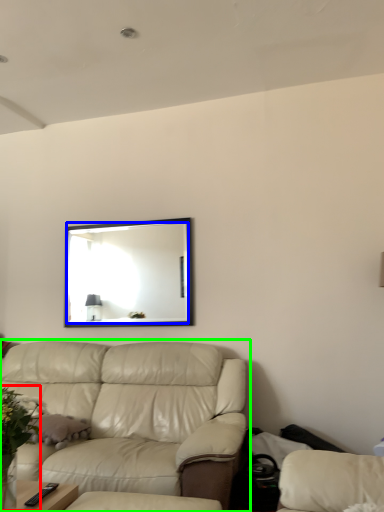
Question: Which object is positioned closest to floral arrangement (highlighted by a red box)? Select from mirror (highlighted by a blue box) and studio couch (highlighted by a green box).

Choices:
 (A) mirror
 (B) studio couch

Answer: (B)